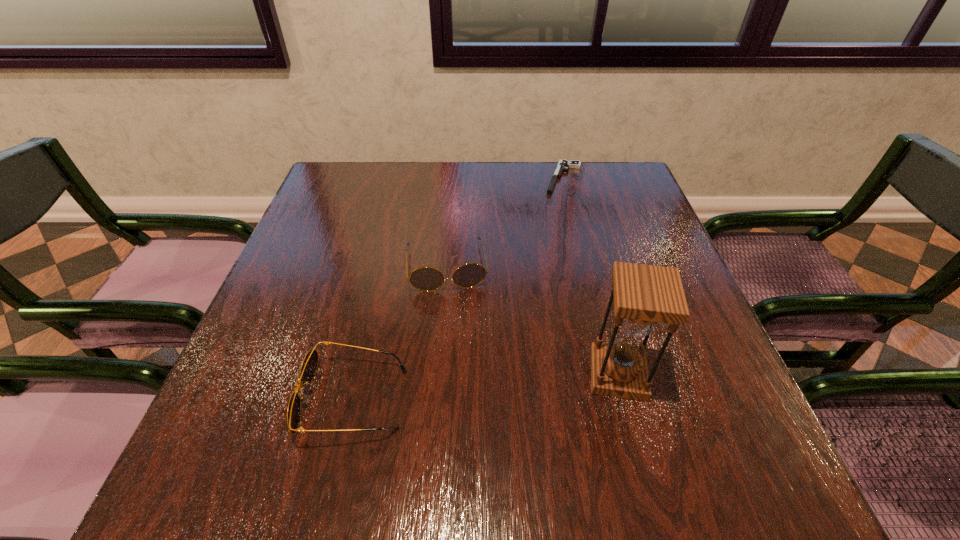
I want to click on the nearer sunglasses, so click(x=309, y=365).

You are a GUI agent. You are given a task and a screenshot of the screen. Output one action in this format:
    pyautogui.click(x=<x>, y=<y>)
    Task: Click on the shorter sunglasses
    Image resolution: width=960 pixels, height=540 pixels.
    Given the screenshot: What is the action you would take?
    pyautogui.click(x=309, y=365)

Where is `hourglass`? hourglass is located at coordinates (644, 295).

At what (x,y) coordinates should I click in order to perform the action: click on the farthest object. Please return your answer as a coordinate pair (x, y). The height and width of the screenshot is (540, 960). Looking at the image, I should click on (563, 165).

Locate an element on the screen. pistol is located at coordinates (563, 165).

Find the location of a particular element. This screenshot has height=540, width=960. the second farthest object is located at coordinates (468, 275).

Where is `the farther sunglasses`? This screenshot has height=540, width=960. the farther sunglasses is located at coordinates (468, 275).

This screenshot has width=960, height=540. I want to click on free space located on the front-facing side of the third tallest object, so click(234, 399).

You are a GUI agent. You are given a task and a screenshot of the screen. Output one action in this format:
    pyautogui.click(x=<x>, y=<y>)
    Task: Click on the free spot located on the back of the tallest object
    
    Given the screenshot: What is the action you would take?
    pyautogui.click(x=579, y=226)

Where is `free spot located 0.300m on the front-facing side of the pistol`? The image size is (960, 540). free spot located 0.300m on the front-facing side of the pistol is located at coordinates 539,262.